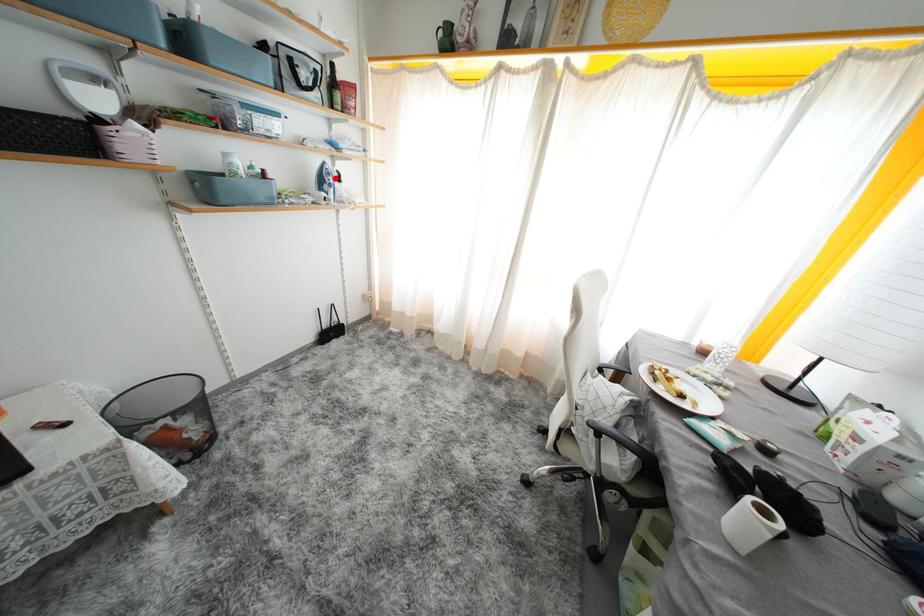
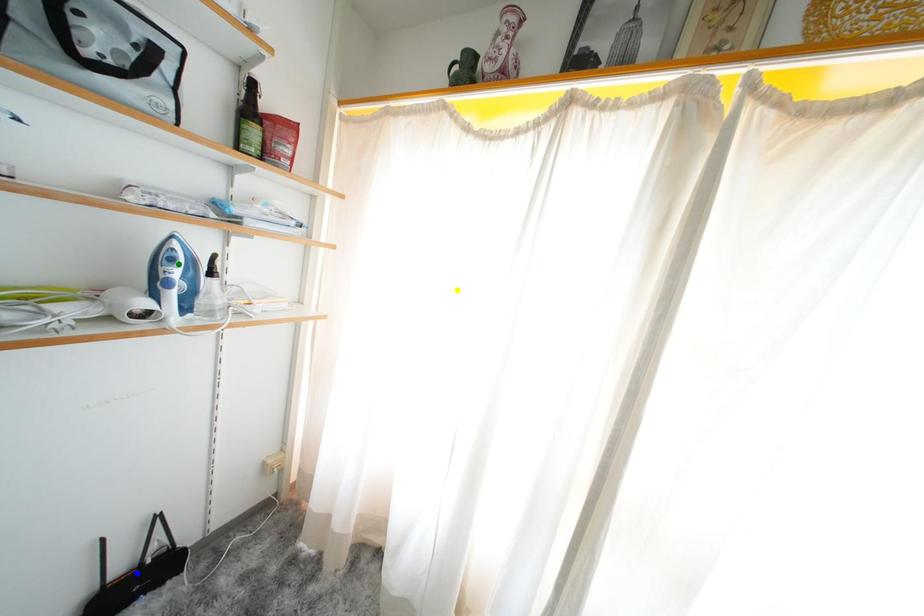
Question: I am providing you with two images of the same scene from different viewpoints. A red point is marked on the first image. You are given multiple points on the second image. Which mark in image 2 goes with the point in image 1?

Choices:
 (A) yellow point
 (B) blue point
 (C) green point

Answer: (C)